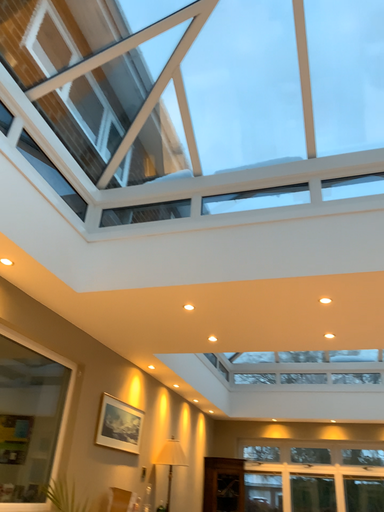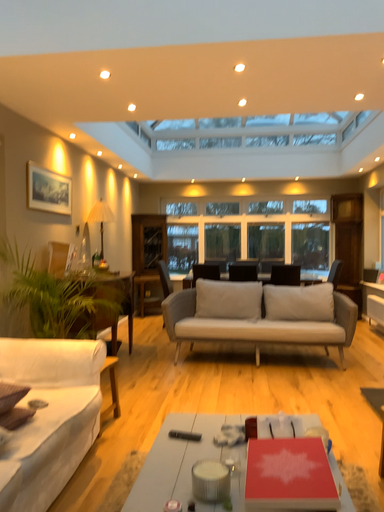
Question: Which way did the camera rotate in the video?

Choices:
 (A) rotated right
 (B) rotated left

Answer: (A)